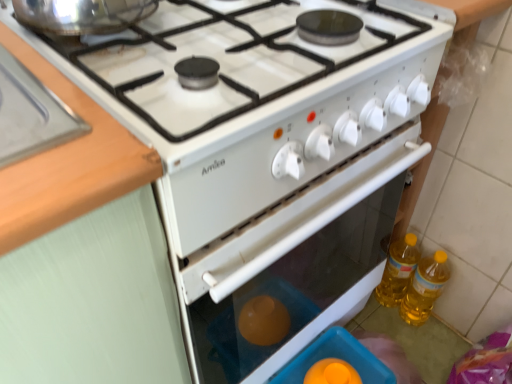
Where is `free space above translucent plastic container at lower center (from a real-world perspective)`? free space above translucent plastic container at lower center (from a real-world perspective) is located at coordinates (344, 360).